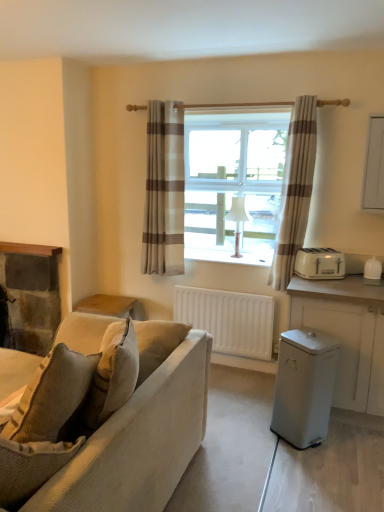
Locate an element on the screen. This screenshot has width=384, height=512. vacant area in front of white fabric lampshade at window is located at coordinates (239, 264).